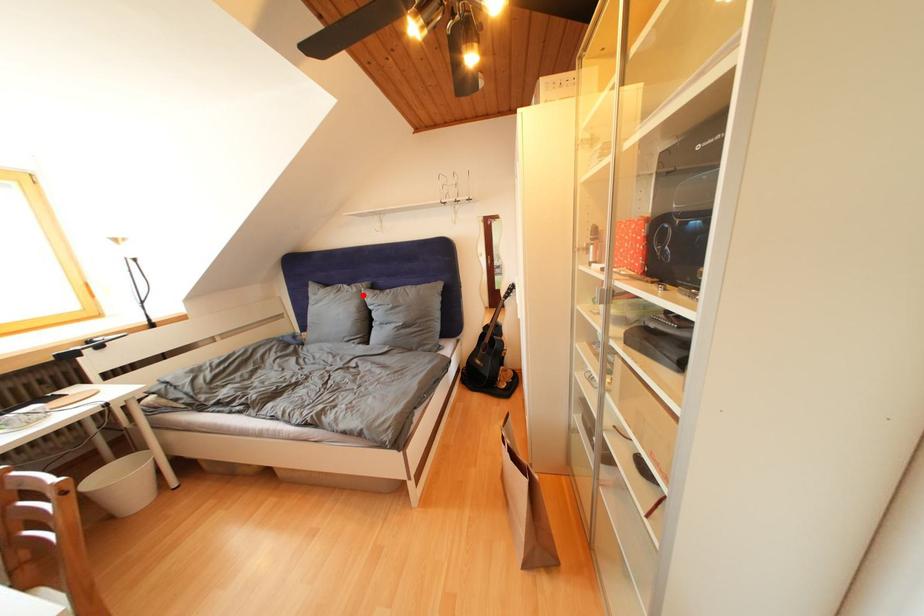
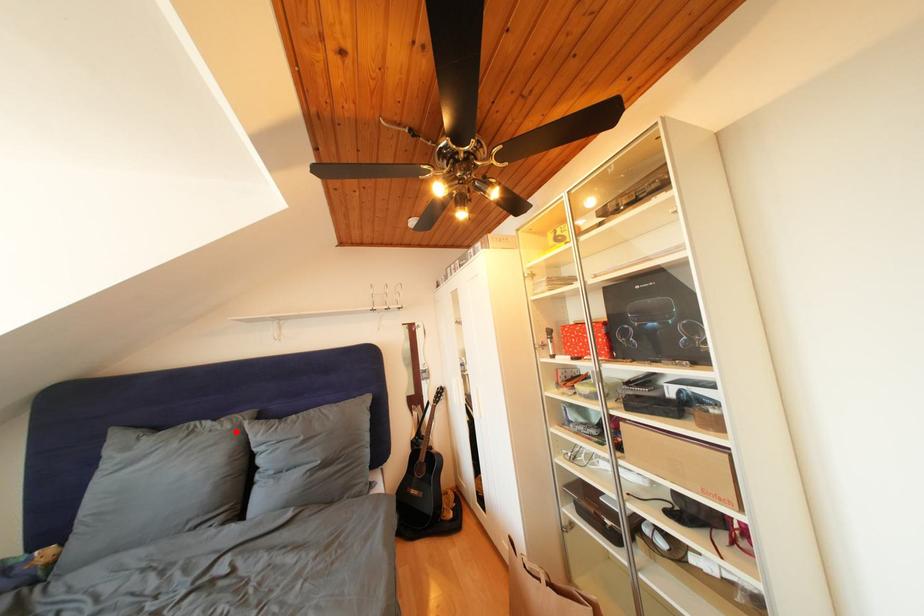
I am providing you with two images of the same scene from different viewpoints. A red point is marked on the first image and another point is marked on the second image. Does the point marked in image1 correspond to the same location as the one in image2?

Yes